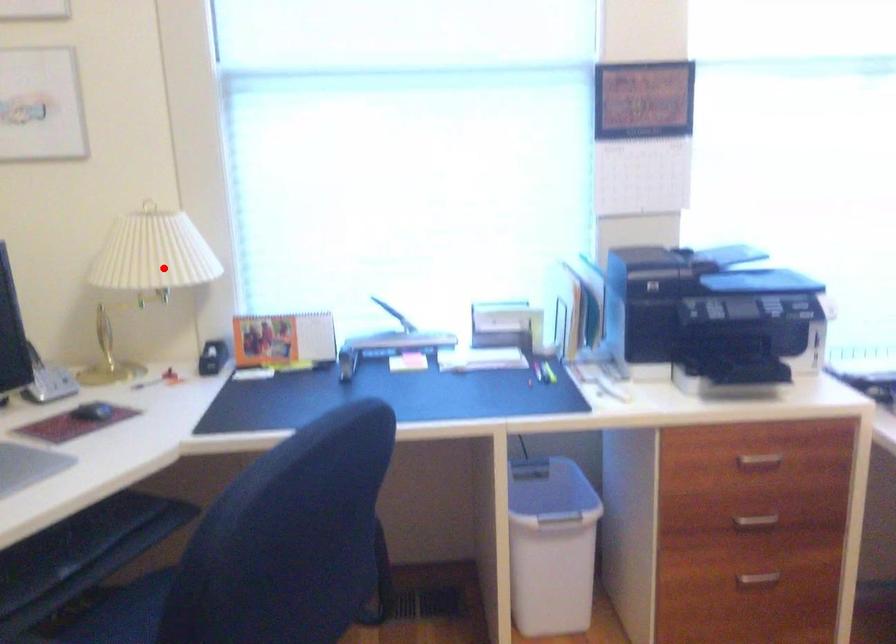
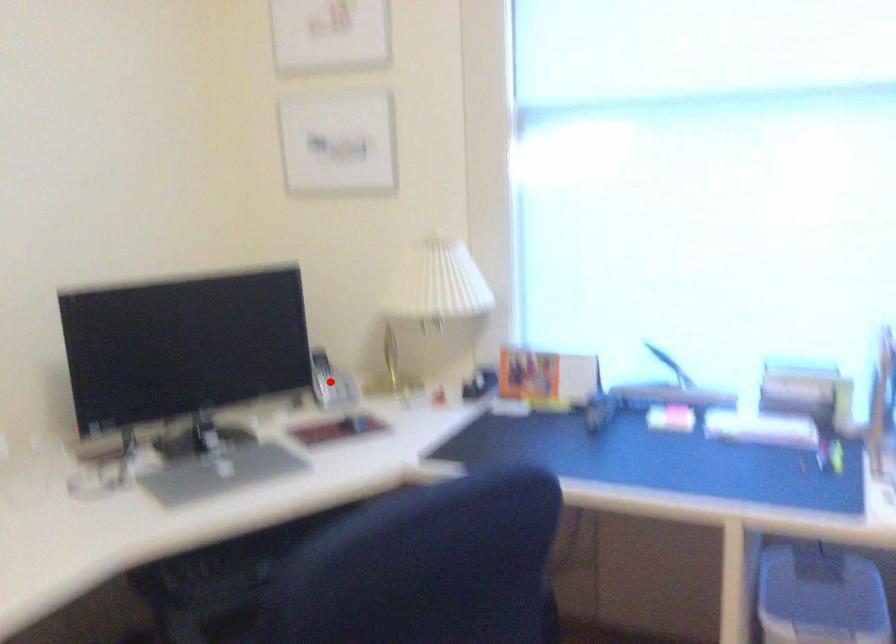
I am providing you with two images of the same scene from different viewpoints. A red point is marked on the first image and another point is marked on the second image. Are the points marked in image1 and image2 representing the same 3D position?

No